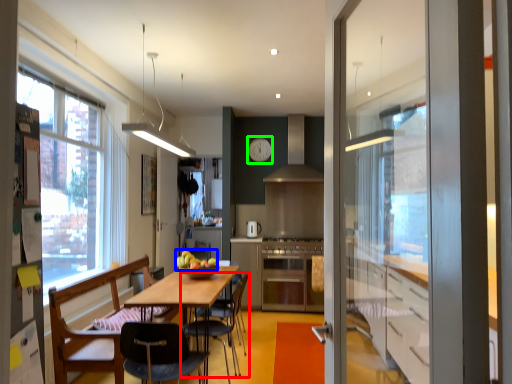
Question: Considering the real-world distances, which object is closest to chair (highlighted by a red box)? apple (highlighted by a blue box) or clock (highlighted by a green box).

Choices:
 (A) apple
 (B) clock

Answer: (A)